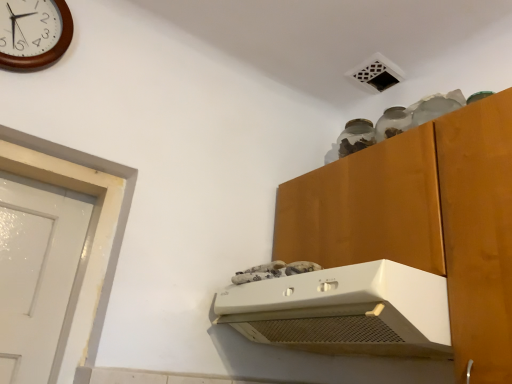
Describe the element at coordinates (33, 33) in the screenshot. I see `wooden clock at upper left` at that location.

Locate an element on the screen. The image size is (512, 384). wooden clock at upper left is located at coordinates (33, 33).

The height and width of the screenshot is (384, 512). Identify the location of white plastic range hood at upper center. (345, 311).

The image size is (512, 384). Describe the element at coordinates (345, 311) in the screenshot. I see `white plastic range hood at upper center` at that location.

Locate an element on the screen. The image size is (512, 384). wooden clock at upper left is located at coordinates (33, 33).

Based on their positions, is wooden clock at upper left located to the left or right of white plastic range hood at upper center?

wooden clock at upper left is to the left of white plastic range hood at upper center.

Consider the image. Which object is further away from the camera, wooden clock at upper left or white plastic range hood at upper center?

wooden clock at upper left is further away from the camera.

Does point (6, 12) come closer to viewer compared to point (315, 323)?

No, it is not.

From the image's perspective, is wooden clock at upper left located beneath white plastic range hood at upper center?

No.

Consider the image. From a real-world perspective, between wooden clock at upper left and white plastic range hood at upper center, who is vertically higher?

wooden clock at upper left.

Can you confirm if wooden clock at upper left is wider than white plastic range hood at upper center?

In fact, wooden clock at upper left might be narrower than white plastic range hood at upper center.

Considering the relative sizes of wooden clock at upper left and white plastic range hood at upper center in the image provided, is wooden clock at upper left taller than white plastic range hood at upper center?

Correct, wooden clock at upper left is much taller as white plastic range hood at upper center.

Between wooden clock at upper left and white plastic range hood at upper center, which one has larger size?

Bigger between the two is white plastic range hood at upper center.

Which is correct: wooden clock at upper left is inside white plastic range hood at upper center, or outside of it?

wooden clock at upper left is spatially situated outside white plastic range hood at upper center.

Is wooden clock at upper left not close to white plastic range hood at upper center?

No, wooden clock at upper left is in close proximity to white plastic range hood at upper center.

Is wooden clock at upper left facing away from white plastic range hood at upper center?

No, wooden clock at upper left's orientation is not away from white plastic range hood at upper center.

Measure the distance between wooden clock at upper left and white plastic range hood at upper center.

38.71 inches.

I want to click on home appliance that is on the right side of wooden clock at upper left, so click(x=345, y=311).

Based on their positions, is white plastic range hood at upper center located to the left or right of wooden clock at upper left?

In the image, white plastic range hood at upper center appears on the right side of wooden clock at upper left.

Relative to wooden clock at upper left, is white plastic range hood at upper center in front or behind?

white plastic range hood at upper center is positioned closer to the viewer than wooden clock at upper left.

Between point (445, 328) and point (21, 35), which one is positioned in front?

The point (445, 328) is closer.

From the image's perspective, is white plastic range hood at upper center located above or below wooden clock at upper left?

From the image's perspective, white plastic range hood at upper center appears below wooden clock at upper left.

From a real-world perspective, which object stands above the other?

wooden clock at upper left, from a real-world perspective.

Between white plastic range hood at upper center and wooden clock at upper left, which one has larger width?

Wider between the two is white plastic range hood at upper center.

Is white plastic range hood at upper center shorter than wooden clock at upper left?

Yes.

Is white plastic range hood at upper center bigger than wooden clock at upper left?

Yes, white plastic range hood at upper center is bigger than wooden clock at upper left.

Do you think white plastic range hood at upper center is within wooden clock at upper left, or outside of it?

white plastic range hood at upper center is not enclosed by wooden clock at upper left.

Is white plastic range hood at upper center beside wooden clock at upper left?

No.

Could you tell me if white plastic range hood at upper center is turned towards wooden clock at upper left?

No, white plastic range hood at upper center is not facing towards wooden clock at upper left.

Find the location of a particular element. home appliance that appears in front of the wooden clock at upper left is located at coordinates (x=345, y=311).

Find the location of a particular element. wall clock above the white plastic range hood at upper center (from the image's perspective) is located at coordinates (33, 33).

Find the location of a particular element. The image size is (512, 384). home appliance in front of the wooden clock at upper left is located at coordinates (345, 311).